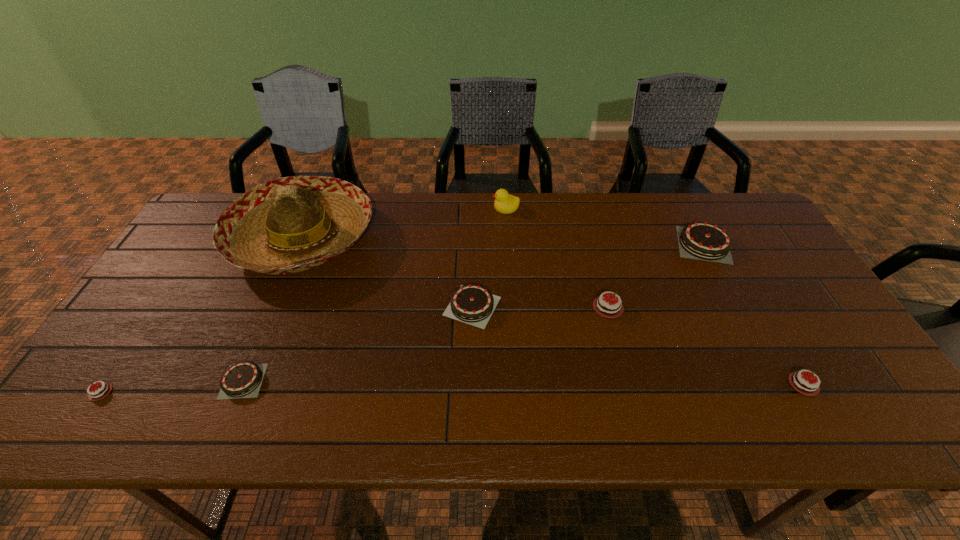
At what (x,y) coordinates should I click in order to perform the action: click on free area in between the second brown chocolate cake from right to left and the rightmost red chocolate cake. Please return your answer as a coordinate pair (x, y). Image resolution: width=960 pixels, height=540 pixels. Looking at the image, I should click on (637, 345).

Identify which object is located as the second nearest to the smallest red chocolate cake. Please provide its 2D coordinates. Your answer should be formatted as a tuple, i.e. [(x, y)], where the tuple contains the x and y coordinates of a point satisfying the conditions above.

[(291, 224)]

At what (x,y) coordinates should I click in order to perform the action: click on object that is the fourth nearest to the nearest brown chocolate cake. Please return your answer as a coordinate pair (x, y). Image resolution: width=960 pixels, height=540 pixels. Looking at the image, I should click on (603, 307).

Locate an element on the screen. This screenshot has width=960, height=540. chocolate cake that is the fifth closest to the fourth chocolate cake from right to left is located at coordinates (100, 392).

Select which chocolate cake appears as the closest to the seventh shortest object. Please provide its 2D coordinates. Your answer should be formatted as a tuple, i.e. [(x, y)], where the tuple contains the x and y coordinates of a point satisfying the conditions above.

[(473, 304)]

Point out which brown chocolate cake is positioned as the third nearest to the farthest red chocolate cake. Please provide its 2D coordinates. Your answer should be formatted as a tuple, i.e. [(x, y)], where the tuple contains the x and y coordinates of a point satisfying the conditions above.

[(242, 380)]

The width and height of the screenshot is (960, 540). I want to click on brown chocolate cake that is the second closest to the rightmost red chocolate cake, so click(473, 304).

At what (x,y) coordinates should I click in order to perform the action: click on red chocolate cake that stands as the second closest to the red sombrero. Please return your answer as a coordinate pair (x, y). The height and width of the screenshot is (540, 960). Looking at the image, I should click on (603, 307).

Locate which red chocolate cake ranks second in proximity to the red sombrero. Please provide its 2D coordinates. Your answer should be formatted as a tuple, i.e. [(x, y)], where the tuple contains the x and y coordinates of a point satisfying the conditions above.

[(603, 307)]

Find the location of a particular element. free space that satisfies the following two spatial constraints: 1. on the face of the second tallest object; 2. on the front side of the shortest chocolate cake is located at coordinates (517, 392).